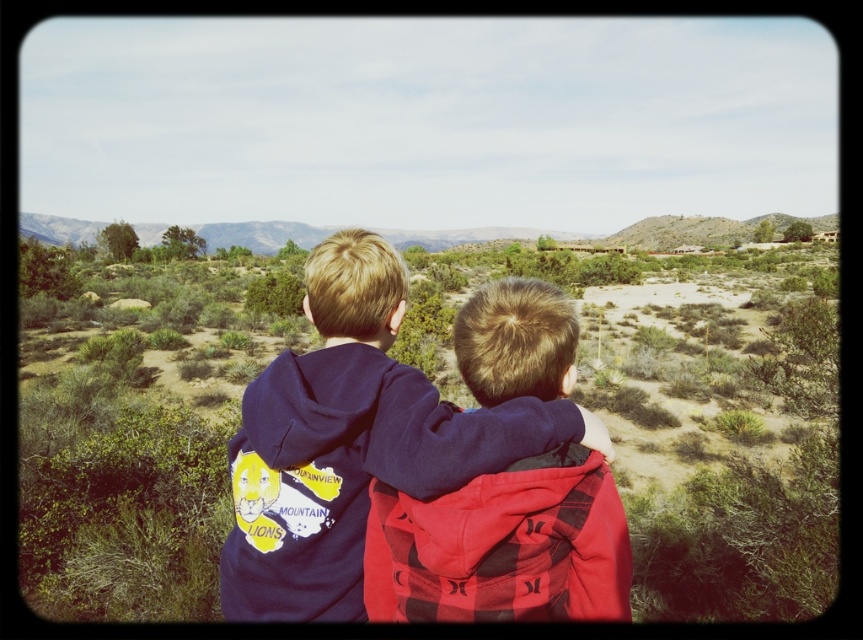
Which is behind, point (789, 403) or point (366, 332)?

The point (789, 403) is more distant.

Between green shrubs at center and matte blue hoodie at center, which one has more height?

green shrubs at center

Is point (39, 605) behind point (318, 372)?

Yes, point (39, 605) is behind point (318, 372).

Image resolution: width=863 pixels, height=640 pixels. I want to click on green shrubs at center, so click(408, 497).